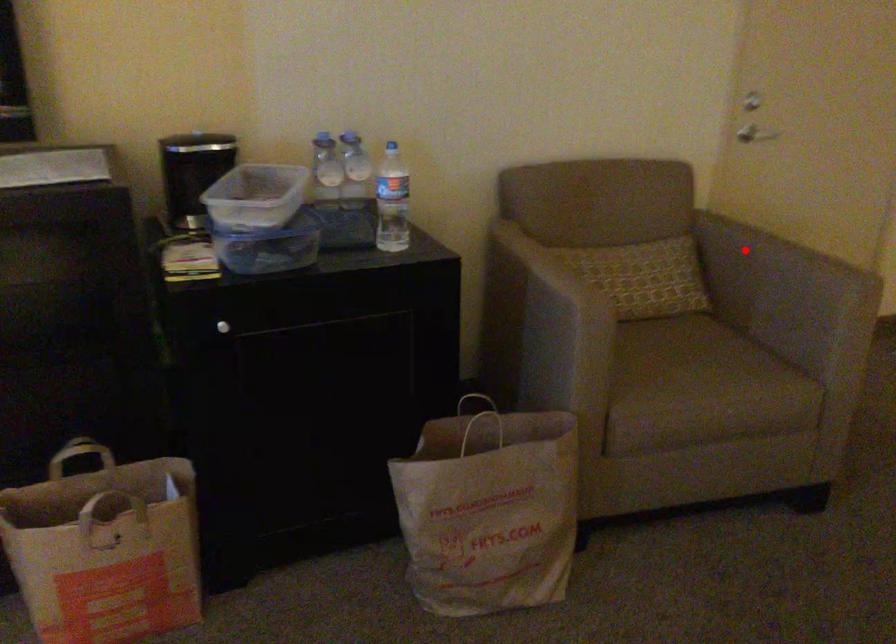
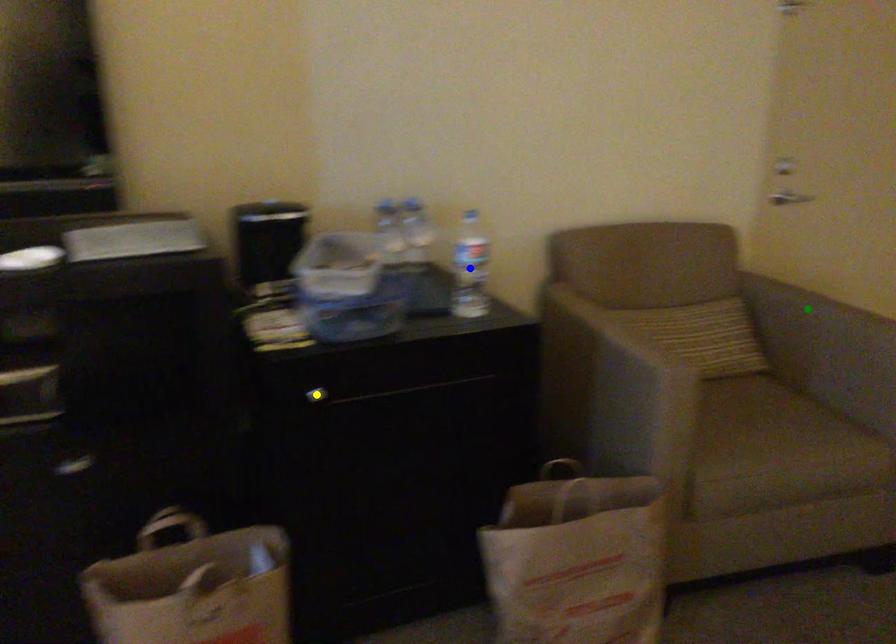
Question: I am providing you with two images of the same scene from different viewpoints. A red point is marked on the first image. You are given multiple points on the second image. Which mark in image 2 goes with the point in image 1?

Choices:
 (A) blue point
 (B) green point
 (C) yellow point

Answer: (B)